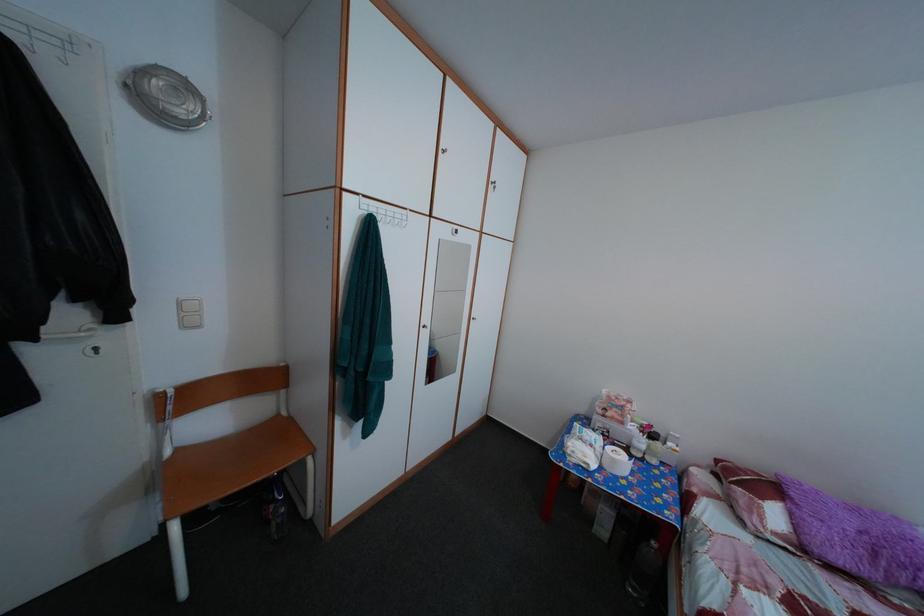
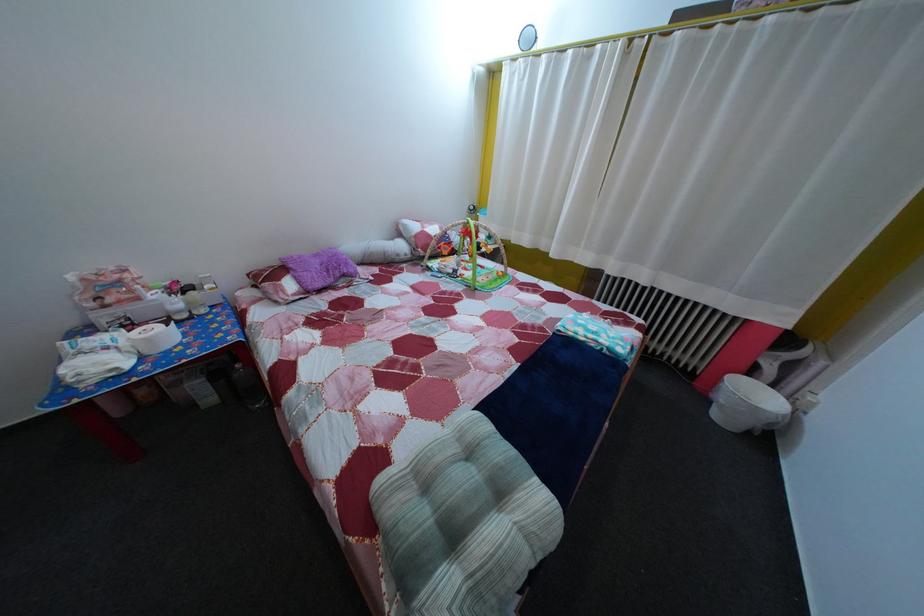
In the second image, find the point that corresponds to point (663, 552) in the first image.

(248, 374)